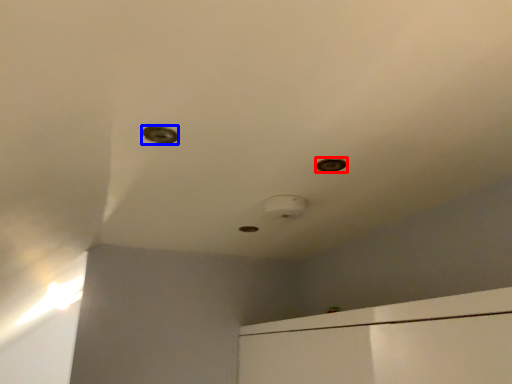
Question: Which point is closer to the camera, hole (highlighted by a red box) or hole (highlighted by a blue box)?

Choices:
 (A) hole
 (B) hole

Answer: (B)